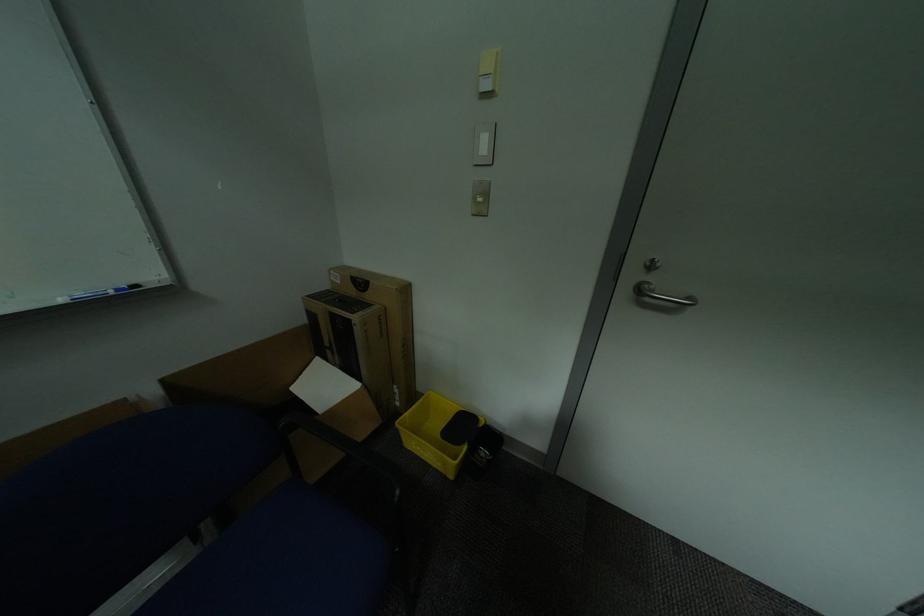
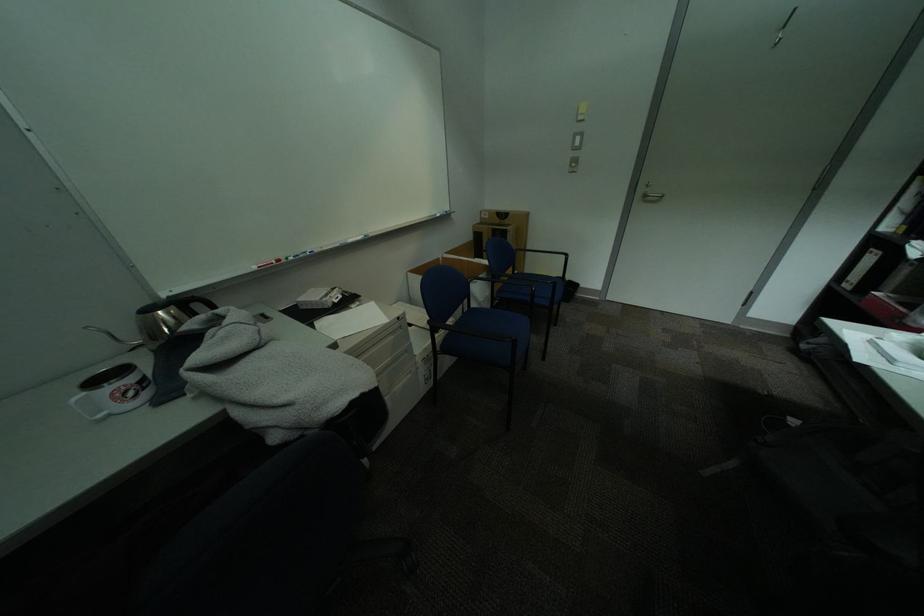
Where in the second image is the point corresponding to point 137,400 from the first image?

(450, 259)